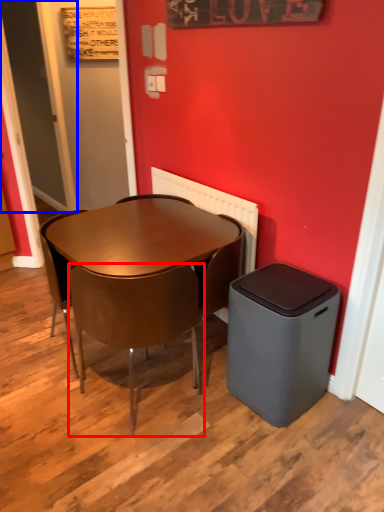
Question: Which of the following is the farthest to the observer, chair (highlighted by a red box) or door (highlighted by a blue box)?

Choices:
 (A) chair
 (B) door

Answer: (B)